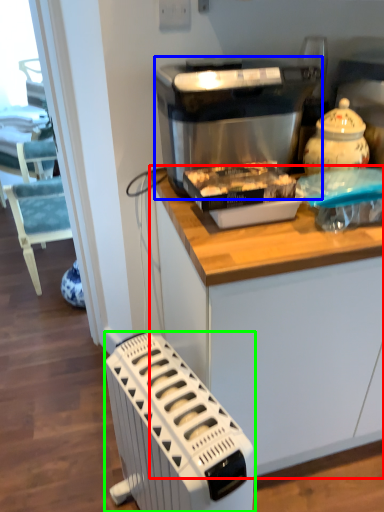
Question: Considering the real-world distances, which object is closest to cabinetry (highlighted by a red box)? kitchen appliance (highlighted by a blue box) or home appliance (highlighted by a green box).

Choices:
 (A) kitchen appliance
 (B) home appliance

Answer: (B)